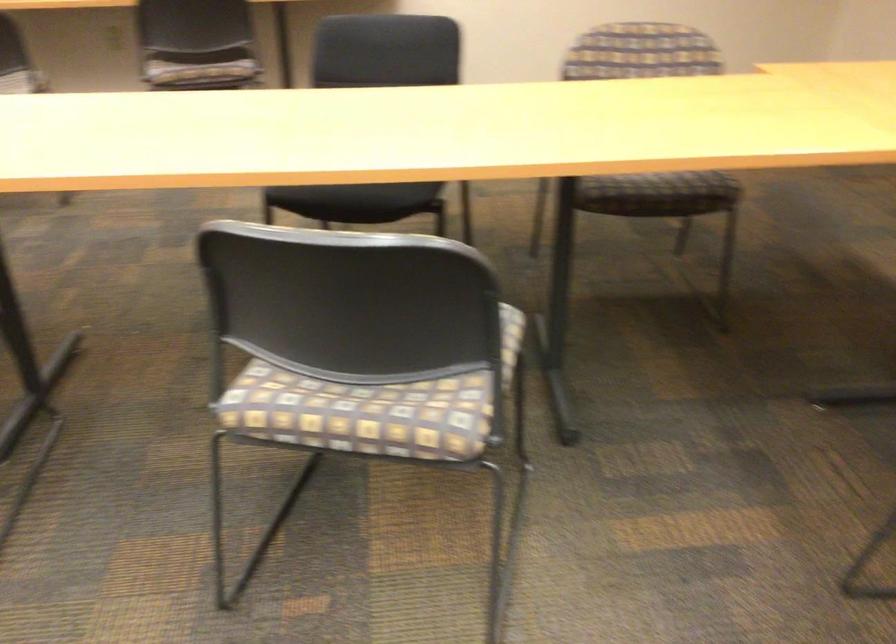
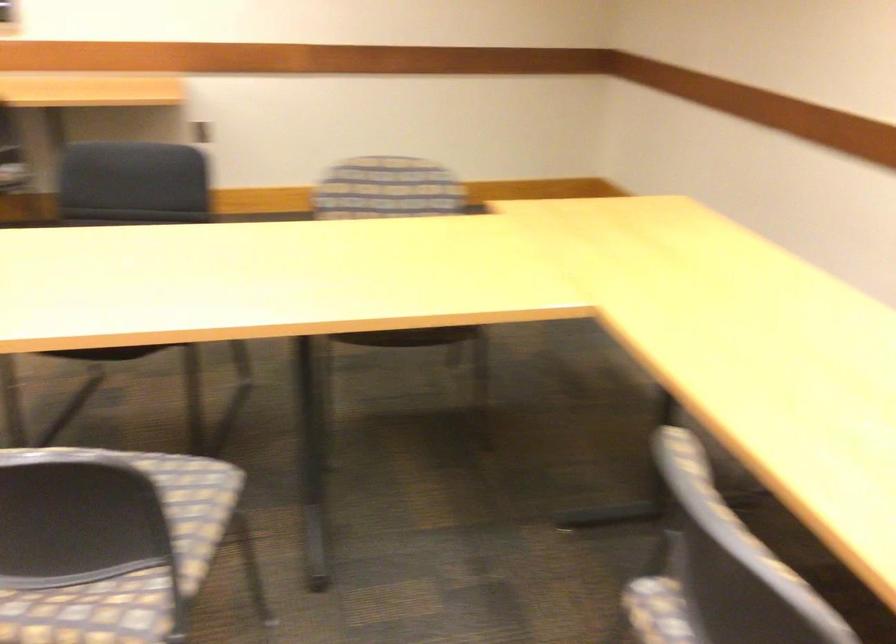
Locate, in the second image, the point that corresponds to the point at 455,357 in the first image.

(126, 558)